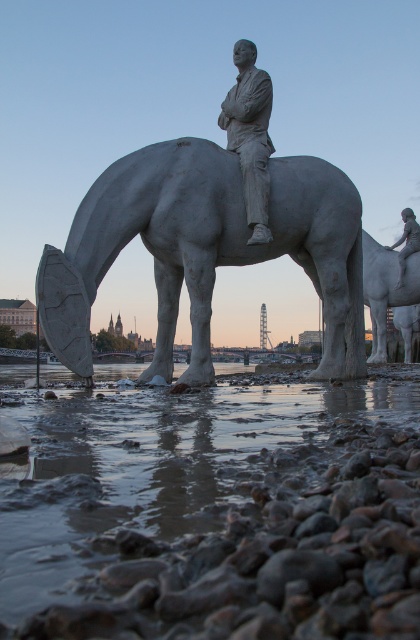
You are a photographer aiming to capture the entire sculpture and the surrounding area in one shot. Given that the muddy water at lower center and the white stone horse at center are both in the frame, which object would require more space in the composition to ensure it is fully visible?

The muddy water at lower center is larger in size than the white stone horse at center, so it would require more space in the composition to ensure it is fully visible.

You are standing on the bridge looking at the sculpture. Which object, the muddy water at lower center or the white stone horse at center, is located to the right of the other?

The muddy water at lower center is positioned on the right side of white stone horse at center.

You are a tourist standing in front of the sculpture area. You want to take a photo of both the white stone horse at center and the matte gray statue at right. Which one should you focus on first to ensure both are in the frame?

You should focus on the white stone horse at center first since it is closer to you than the matte gray statue at right, ensuring both are within the frame when properly composed.